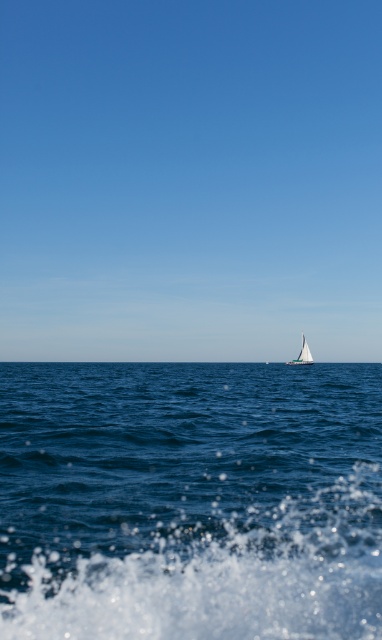
Looking at this image, which is more to the left, blue liquid water at lower center or white sailboat at center?

From the viewer's perspective, blue liquid water at lower center appears more on the left side.

Is point (166, 500) behind point (309, 356)?

No, (166, 500) is closer to viewer.

Where is `blue liquid water at lower center`? Image resolution: width=382 pixels, height=640 pixels. blue liquid water at lower center is located at coordinates (189, 500).